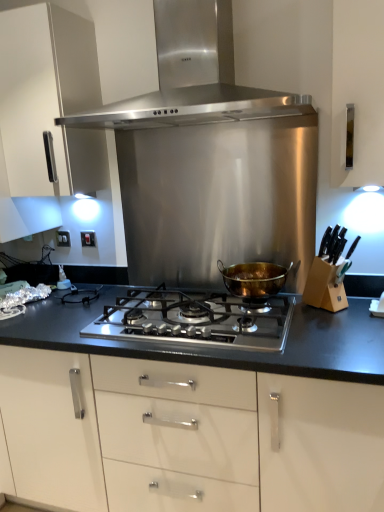
Question: Should I look upward or downward to see white glossy cabinet at upper left?

Choices:
 (A) up
 (B) down

Answer: (A)

Question: Is stainless steel range hood at upper center, which is counted as the 1th kitchen appliance, starting from the top, touching white glossy cabinet at upper left?

Choices:
 (A) no
 (B) yes

Answer: (A)

Question: Is stainless steel range hood at upper center, which is counted as the 1th kitchen appliance, starting from the top, bigger than white glossy cabinet at upper left?

Choices:
 (A) no
 (B) yes

Answer: (A)

Question: Is stainless steel range hood at upper center, which is counted as the 1th kitchen appliance, starting from the top, to the right of white glossy cabinet at upper left from the viewer's perspective?

Choices:
 (A) yes
 (B) no

Answer: (A)

Question: Does stainless steel range hood at upper center, marked as the 2th kitchen appliance in a bottom-to-top arrangement, have a lesser width compared to white glossy cabinet at upper left?

Choices:
 (A) yes
 (B) no

Answer: (B)

Question: Is stainless steel range hood at upper center, marked as the 2th kitchen appliance in a bottom-to-top arrangement, completely or partially outside of white glossy cabinet at upper left?

Choices:
 (A) yes
 (B) no

Answer: (A)

Question: Can you confirm if stainless steel range hood at upper center, marked as the 2th kitchen appliance in a bottom-to-top arrangement, is wider than white glossy cabinet at upper left?

Choices:
 (A) yes
 (B) no

Answer: (A)

Question: Is gold metallic pot at center, the first kitchen appliance when ordered from bottom to top, turned away from stainless steel gas stove at center?

Choices:
 (A) no
 (B) yes

Answer: (A)

Question: Is stainless steel gas stove at center located within gold metallic pot at center, the second kitchen appliance positioned from the top?

Choices:
 (A) yes
 (B) no

Answer: (B)

Question: Are gold metallic pot at center, the first kitchen appliance when ordered from bottom to top, and stainless steel gas stove at center beside each other?

Choices:
 (A) no
 (B) yes

Answer: (A)

Question: Does gold metallic pot at center, the second kitchen appliance positioned from the top, have a smaller size compared to stainless steel gas stove at center?

Choices:
 (A) no
 (B) yes

Answer: (B)

Question: Is gold metallic pot at center, the second kitchen appliance positioned from the top, positioned before stainless steel gas stove at center?

Choices:
 (A) no
 (B) yes

Answer: (A)

Question: Is gold metallic pot at center, the first kitchen appliance when ordered from bottom to top, thinner than stainless steel gas stove at center?

Choices:
 (A) no
 (B) yes

Answer: (B)

Question: Is white plastic electric outlet at left, which ranks as the 1th electric outlet in back-to-front order, positioned before white plastic electric outlet at left, the first electric outlet from the front?

Choices:
 (A) no
 (B) yes

Answer: (A)